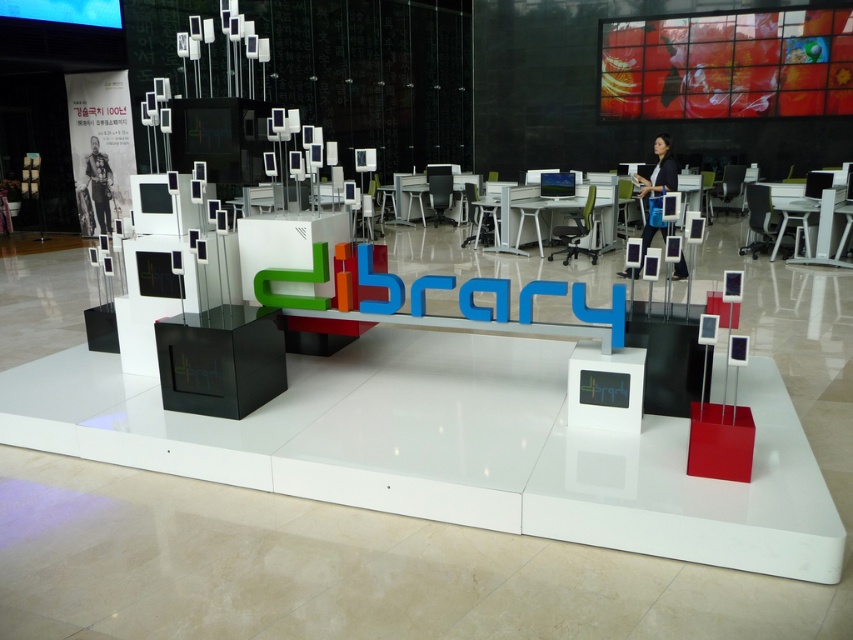
Question: Which object is positioned farthest from the green fabric chair at center?

Choices:
 (A) matte black chair at center
 (B) matte white chair at center
 (C) black plastic chair at right
 (D) white plastic chair at center

Answer: (A)

Question: Does green fabric chair at center appear on the left side of matte black chair at center?

Choices:
 (A) no
 (B) yes

Answer: (B)

Question: Among these objects, which one is farthest from the camera?

Choices:
 (A) green fabric chair at center
 (B) black plastic chair at right
 (C) matte black chair at center
 (D) white plastic chair at center

Answer: (C)

Question: Is matte white chair at center positioned behind matte black chair at center?

Choices:
 (A) yes
 (B) no

Answer: (B)

Question: Does black plastic chair at right have a lesser width compared to white plastic chair at center?

Choices:
 (A) yes
 (B) no

Answer: (B)

Question: Which object is the closest to the matte black chair at center?

Choices:
 (A) green fabric chair at center
 (B) matte white chair at center
 (C) white plastic chair at center
 (D) black plastic chair at right

Answer: (D)